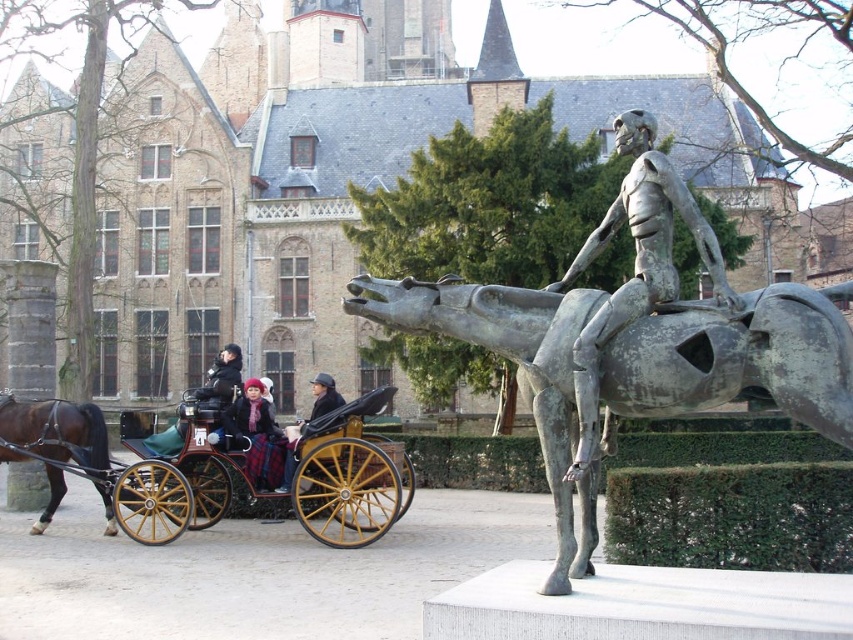
Question: Does wooden polished cart at center appear over bronze skeleton at center?

Choices:
 (A) no
 (B) yes

Answer: (A)

Question: Which object is the closest to the dark blue coat at center?

Choices:
 (A) bronze skeleton at center
 (B) wooden polished cart at center
 (C) bronze horse and rider at center
 (D) plaid fabric coat at center

Answer: (D)

Question: Estimate the real-world distances between objects in this image. Which object is farther from the matte black coat at center?

Choices:
 (A) plaid fabric coat at center
 (B) wooden polished cart at center
 (C) bronze skeleton at center
 (D) dark blue coat at center

Answer: (C)

Question: Which point is farther from the camera taking this photo?

Choices:
 (A) (405, 308)
 (B) (308, 417)
 (C) (227, 401)
 (D) (363, 509)

Answer: (B)

Question: Does shiny brown horse at left have a greater width compared to plaid fabric coat at center?

Choices:
 (A) yes
 (B) no

Answer: (B)

Question: Is wooden polished cart at center below dark blue coat at center?

Choices:
 (A) no
 (B) yes

Answer: (B)